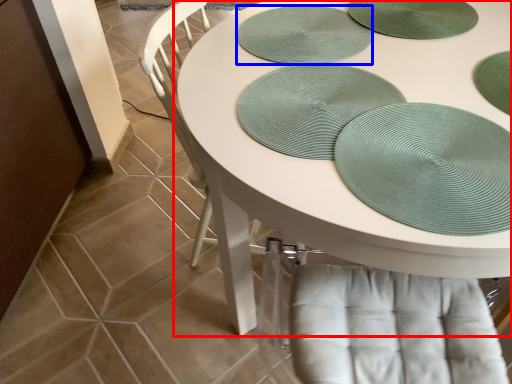
Question: Which of the following is the farthest to the observer, table (highlighted by a red box) or platter (highlighted by a blue box)?

Choices:
 (A) table
 (B) platter

Answer: (B)